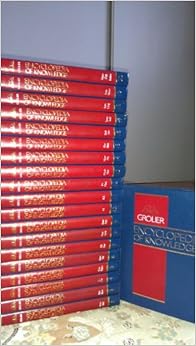
This screenshot has width=196, height=346. Identify the location of book from cover. (128, 185), (127, 300), (189, 320), (191, 192).